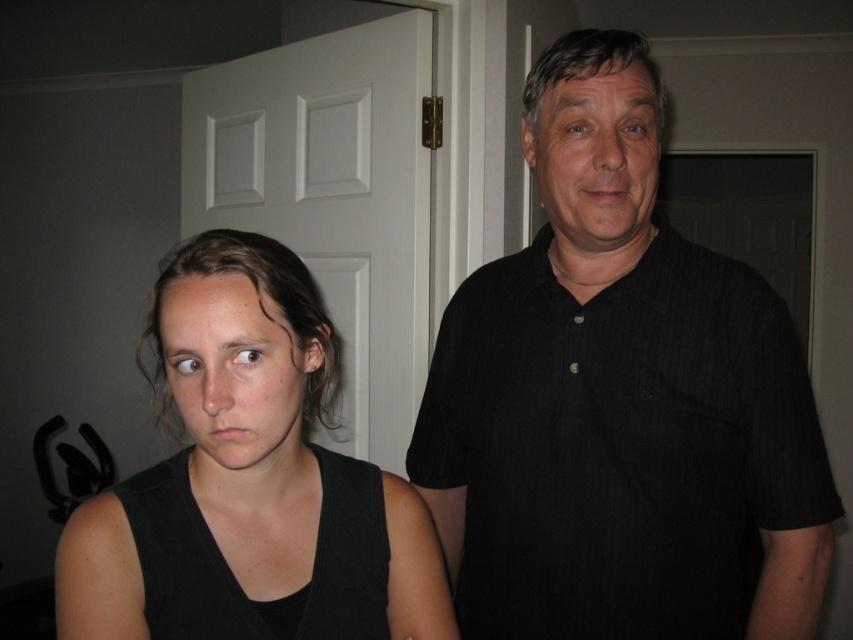
Does matte black tank top at left have a larger size compared to smooth black shirt at center?

Yes.

Consider the image. Does matte black tank top at left have a smaller size compared to smooth black shirt at center?

No.

Who is more distant from viewer, (x=370, y=627) or (x=633, y=157)?

Positioned behind is point (x=633, y=157).

Locate an element on the screen. The image size is (853, 640). matte black tank top at left is located at coordinates pos(254,476).

Can you confirm if black striped shirt at center is wider than matte black tank top at left?

Yes.

Who is higher up, black striped shirt at center or matte black tank top at left?

black striped shirt at center

Measure the distance between point (788, 611) and camera.

A distance of 87.94 centimeters exists between point (788, 611) and camera.

The width and height of the screenshot is (853, 640). I want to click on black striped shirt at center, so click(x=618, y=401).

Is matte black tank top at left positioned before matte black face at left?

That is False.

Who is more distant from viewer, (231, 604) or (289, 412)?

The point (231, 604) is more distant.

At what (x,y) coordinates should I click in order to perform the action: click on matte black tank top at left. Please return your answer as a coordinate pair (x, y). Image resolution: width=853 pixels, height=640 pixels. Looking at the image, I should click on (254, 476).

At what (x,y) coordinates should I click in order to perform the action: click on matte black tank top at left. Please return your answer as a coordinate pair (x, y). The image size is (853, 640). Looking at the image, I should click on (254, 476).